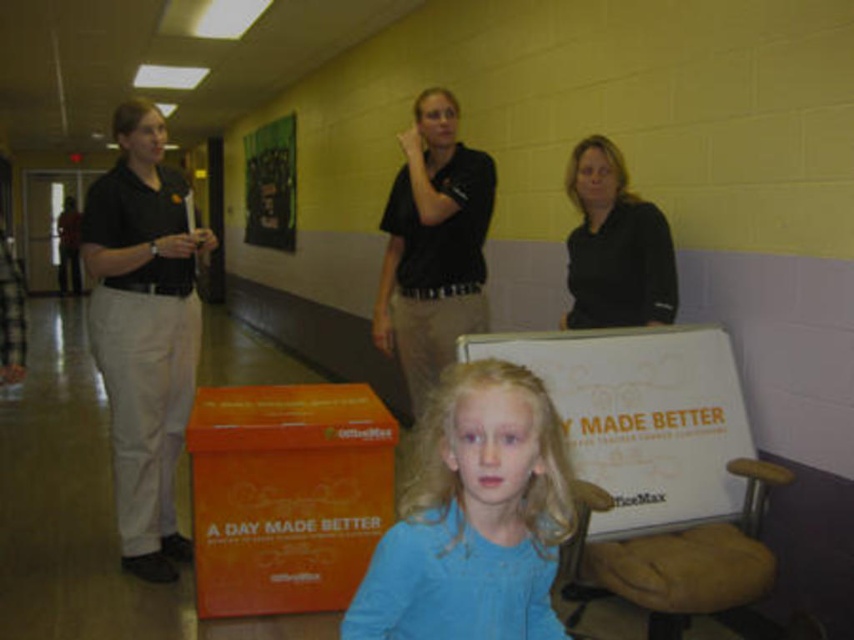
Can you confirm if matte black shirt at left is wider than black matte shirt at center?

Indeed, matte black shirt at left has a greater width compared to black matte shirt at center.

Is point (112, 273) less distant than point (414, 369)?

Yes, point (112, 273) is in front of point (414, 369).

This screenshot has width=854, height=640. Find the location of `matte black shirt at left`. matte black shirt at left is located at coordinates (143, 330).

Does black matte shirt at center lie behind black matte shirt at upper center?

Yes, it is behind black matte shirt at upper center.

Find the location of a particular element. Image resolution: width=854 pixels, height=640 pixels. black matte shirt at center is located at coordinates (433, 244).

Which of these two, orange matte cardboard box at lower left or matte black shirt at left, stands shorter?

With less height is orange matte cardboard box at lower left.

Locate an element on the screen. The width and height of the screenshot is (854, 640). orange matte cardboard box at lower left is located at coordinates (285, 493).